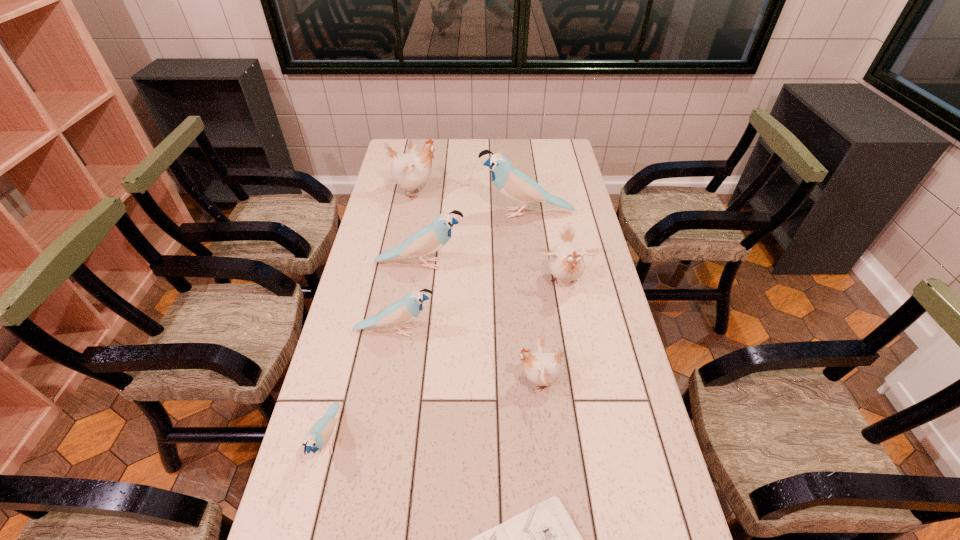
Locate an element on the screen. vacant space that is in between the biggest blue bird and the second smallest blue bird is located at coordinates coord(461,272).

Locate an element on the screen. free spot between the second nearest white bird and the leftmost white bird is located at coordinates (490, 237).

Identify the location of free space between the fourth nearest object and the leftmost white bird. (405, 262).

Find the location of a particular element. This screenshot has height=540, width=960. object that stands as the fifth closest to the smallest white bird is located at coordinates (321, 431).

Identify which object is located as the sixth nearest to the third smallest blue bird. Please provide its 2D coordinates. Your answer should be formatted as a tuple, i.e. [(x, y)], where the tuple contains the x and y coordinates of a point satisfying the conditions above.

[(321, 431)]

Choose which bird is the fourth nearest neighbor to the farthest white bird. Please provide its 2D coordinates. Your answer should be formatted as a tuple, i.e. [(x, y)], where the tuple contains the x and y coordinates of a point satisfying the conditions above.

[(403, 311)]

This screenshot has height=540, width=960. What are the coordinates of `bird that stands as the third closest to the third smallest blue bird` in the screenshot? It's located at (403, 311).

Find the location of a particular element. blue bird that is the second closest one to the smallest white bird is located at coordinates (431, 238).

Locate which blue bird is the second closest to the farthest blue bird. Please provide its 2D coordinates. Your answer should be formatted as a tuple, i.e. [(x, y)], where the tuple contains the x and y coordinates of a point satisfying the conditions above.

[(403, 311)]

Find the location of a particular element. This screenshot has height=540, width=960. the closest white bird to the shortest object is located at coordinates (543, 369).